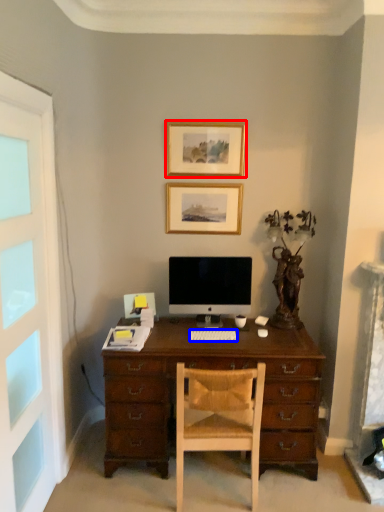
Question: Which of the following is the closest to the observer, picture frame (highlighted by a red box) or computer keyboard (highlighted by a blue box)?

Choices:
 (A) picture frame
 (B) computer keyboard

Answer: (B)